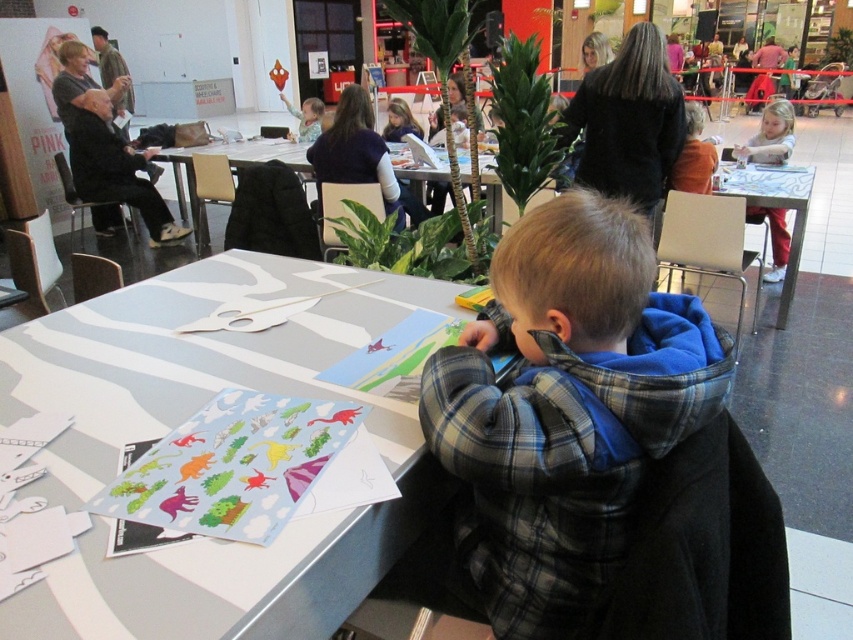
You are organizing a craft activity for children and need to choose a table for a group of 4. The white paper table at center and the white glossy table at right are available. Which table can accommodate more children comfortably?

The white glossy table at right is larger than the white paper table at center, so it can accommodate more children comfortably.

Looking at this image, you are organizing a clothing donation drive and need to determine if the plaid flannel shirt at center and the orange sweater at upper right can fit into a standard donation box that has a maximum capacity of 30 liters. Given their sizes, which one might not fit and why?

The orange sweater at upper right is larger than the plaid flannel shirt at center, so it might not fit into the standard donation box with a 30 liters capacity.